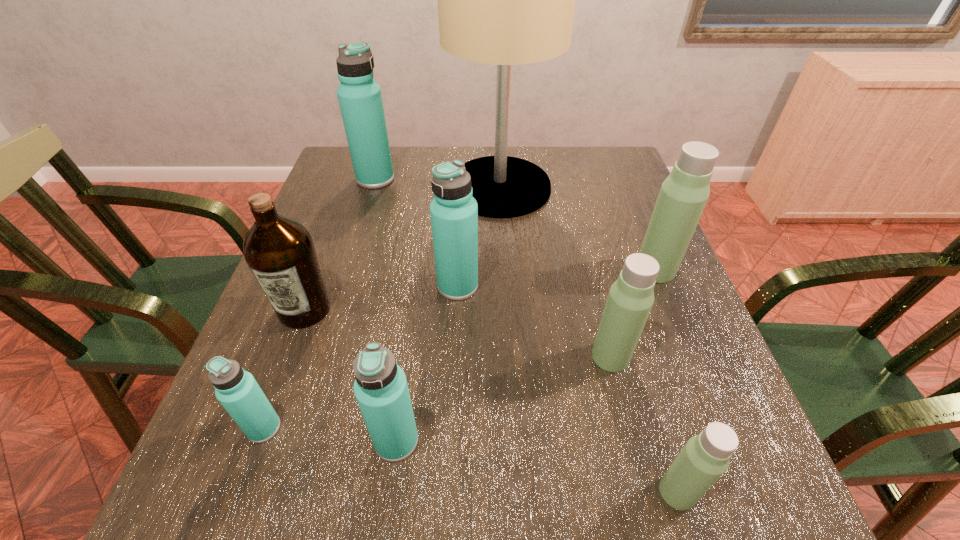
Locate an element on the screen. The width and height of the screenshot is (960, 540). the tallest object is located at coordinates [506, 0].

Locate an element on the screen. beige table lamp is located at coordinates (506, 0).

Where is `the biggest aqua thermos bottle`? the biggest aqua thermos bottle is located at coordinates click(360, 100).

Locate an element on the screen. Image resolution: width=960 pixels, height=540 pixels. the tallest thermos bottle is located at coordinates click(360, 100).

This screenshot has width=960, height=540. Identify the location of the rightmost thermos bottle. (684, 193).

Where is `the rightmost object`? Image resolution: width=960 pixels, height=540 pixels. the rightmost object is located at coordinates (684, 193).

You are a GUI agent. You are given a task and a screenshot of the screen. Output one action in this format:
    pyautogui.click(x=<x>, y=<y>)
    Task: Click on the rightmost aqua thermos bottle
    The height and width of the screenshot is (540, 960).
    Given the screenshot: What is the action you would take?
    pyautogui.click(x=454, y=212)

What are the coordinates of `the second farthest aqua thermos bottle` in the screenshot? It's located at (454, 212).

I want to click on olive oil, so click(x=280, y=252).

You are a GUI agent. You are given a task and a screenshot of the screen. Output one action in this format:
    pyautogui.click(x=<x>, y=<y>)
    Task: Click on the third aqua thermos bottle from left to right
    The image size is (960, 540).
    Given the screenshot: What is the action you would take?
    click(380, 387)